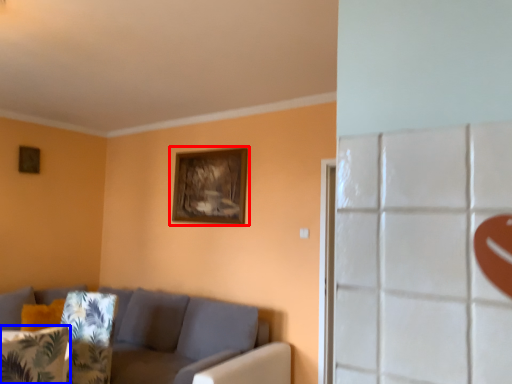
Question: Which point is closer to the camera, picture frame (highlighted by a red box) or pillow (highlighted by a blue box)?

Choices:
 (A) picture frame
 (B) pillow

Answer: (B)